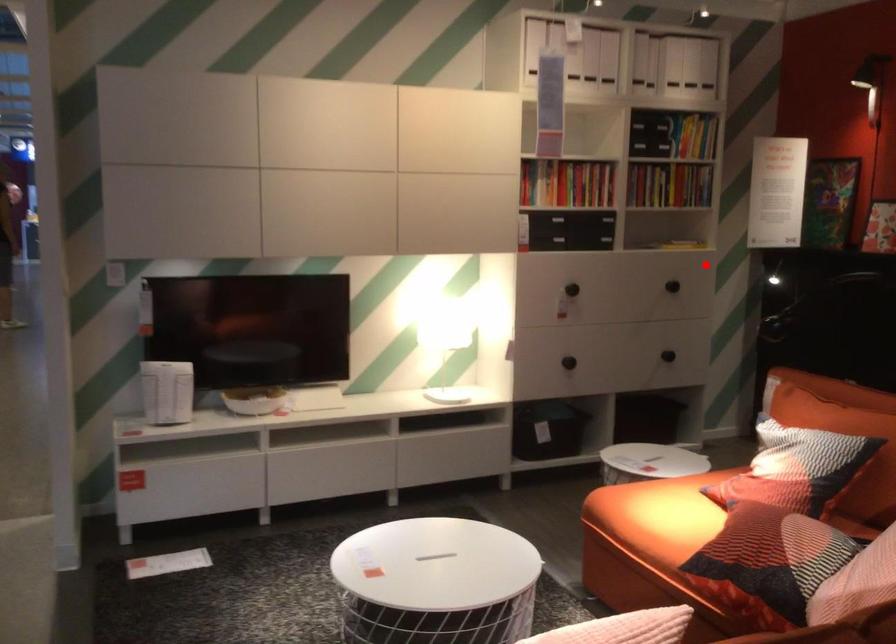
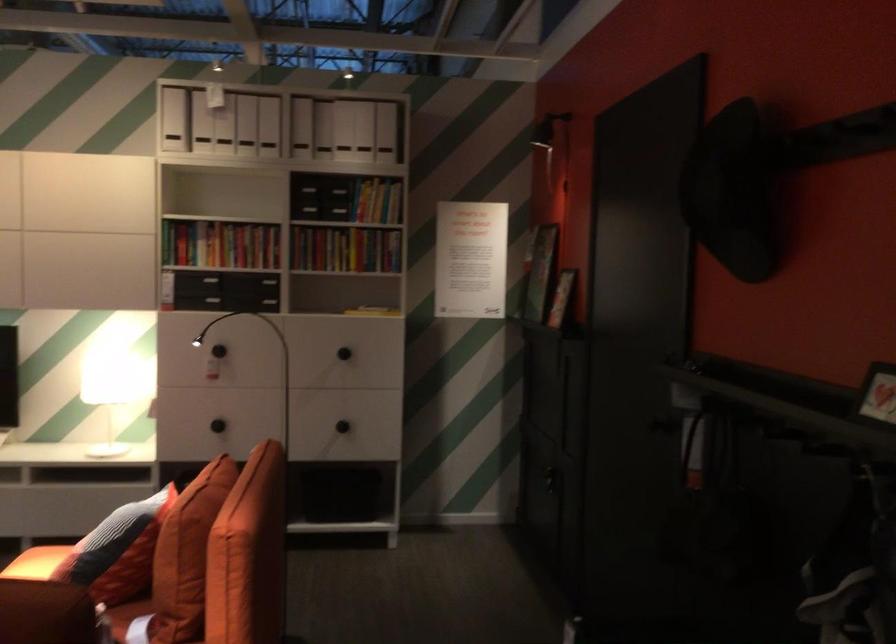
Find the pixel in the second image that matches the highlighted location in the first image.

(343, 353)